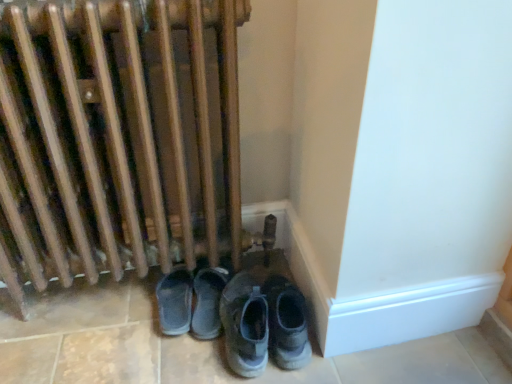
Question: Considering the positions of point (289, 369) and point (227, 347), is point (289, 369) closer or farther from the camera than point (227, 347)?

Choices:
 (A) closer
 (B) farther

Answer: (A)

Question: Would you say gray fabric sneakers at lower center, placed as the 3th footwear when sorted from left to right, is to the left or to the right of gray suede sneakers at lower center, the 2th footwear positioned from the left, in the picture?

Choices:
 (A) right
 (B) left

Answer: (A)

Question: Which is farther from the gray suede shoes at lower center, positioned as the third footwear in right-to-left order?

Choices:
 (A) gray suede sneakers at lower center, which ranks as the second footwear in right-to-left order
 (B) gray fabric sneakers at lower center, placed as the 3th footwear when sorted from left to right
 (C) wooden radiator at lower left

Answer: (C)

Question: Which is nearer to the gray suede shoes at lower center, positioned as the third footwear in right-to-left order?

Choices:
 (A) gray fabric sneakers at lower center, which ranks as the 1th footwear in right-to-left order
 (B) gray suede sneakers at lower center, which ranks as the second footwear in right-to-left order
 (C) wooden radiator at lower left

Answer: (B)